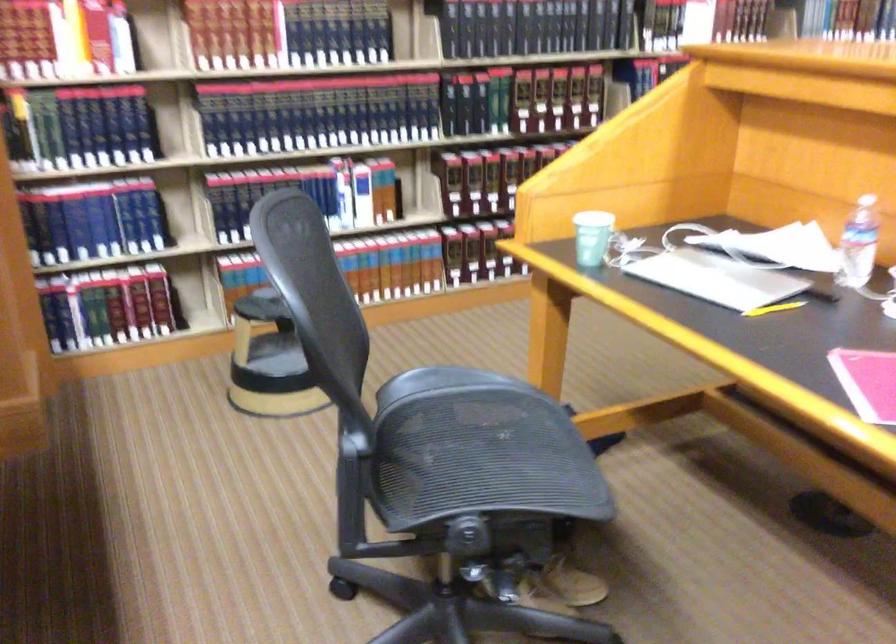
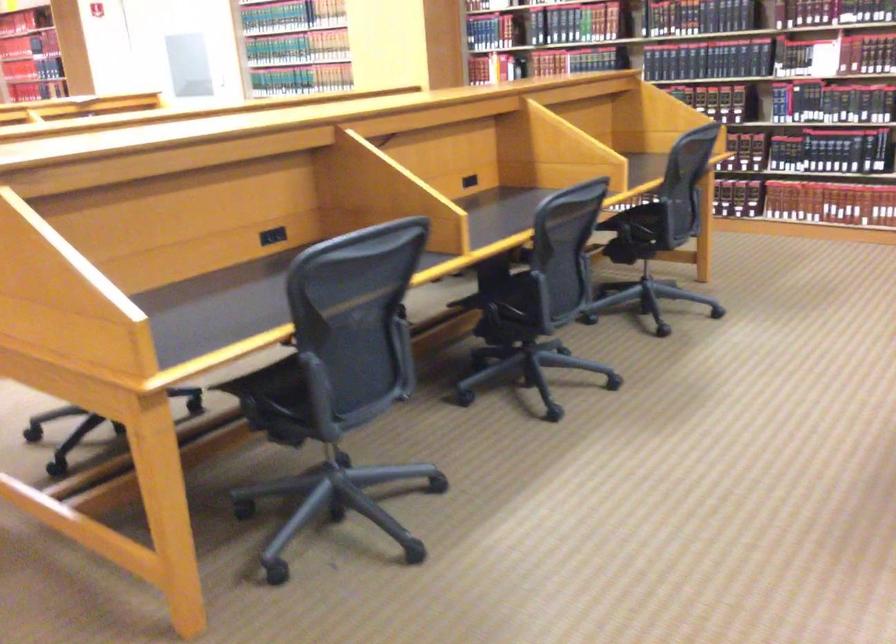
Question: I am providing you with two images of the same scene from different viewpoints. After the viewpoint changes to image2, which objects are now occluded?

Choices:
 (A) white rocker switch
 (B) green paper cup
 (C) hardcover book
 (D) black power outlet

Answer: (B)